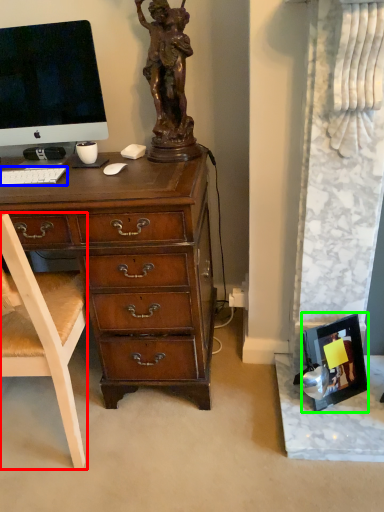
Question: Which object is the farthest from chair (highlighted by a red box)? Choose among these: computer keyboard (highlighted by a blue box) or picture frame (highlighted by a green box).

Choices:
 (A) computer keyboard
 (B) picture frame

Answer: (B)